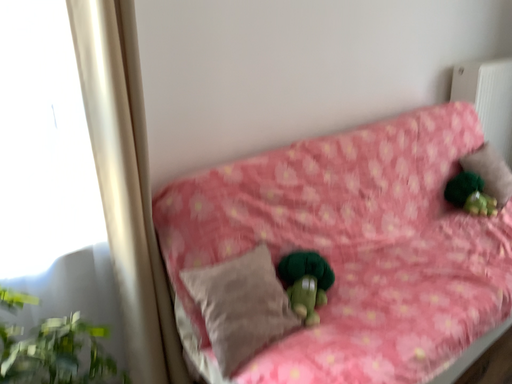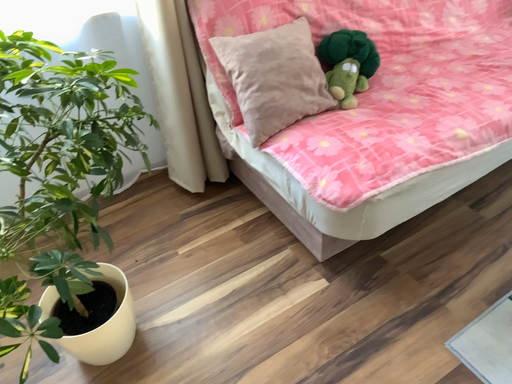
Question: Which way did the camera rotate in the video?

Choices:
 (A) rotated downward
 (B) rotated upward

Answer: (A)